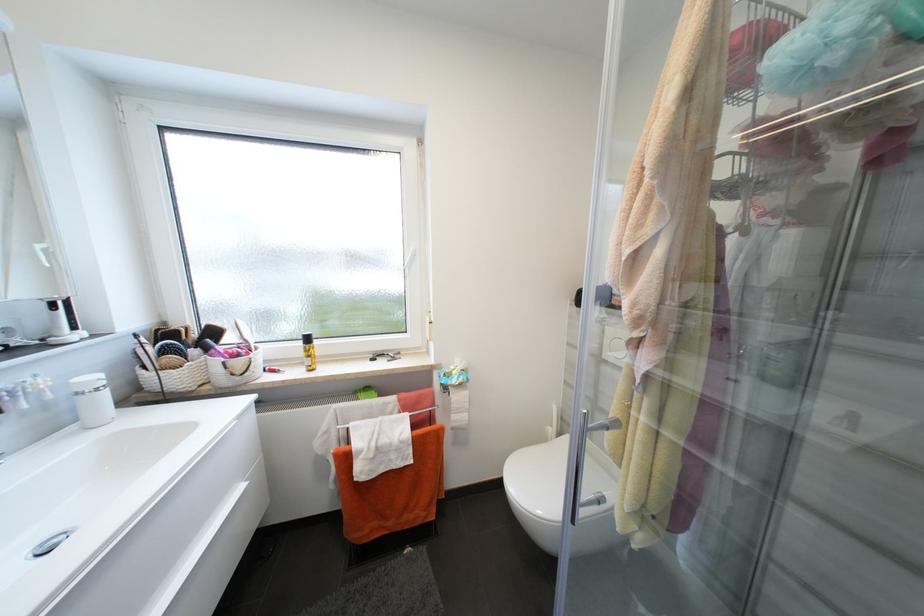
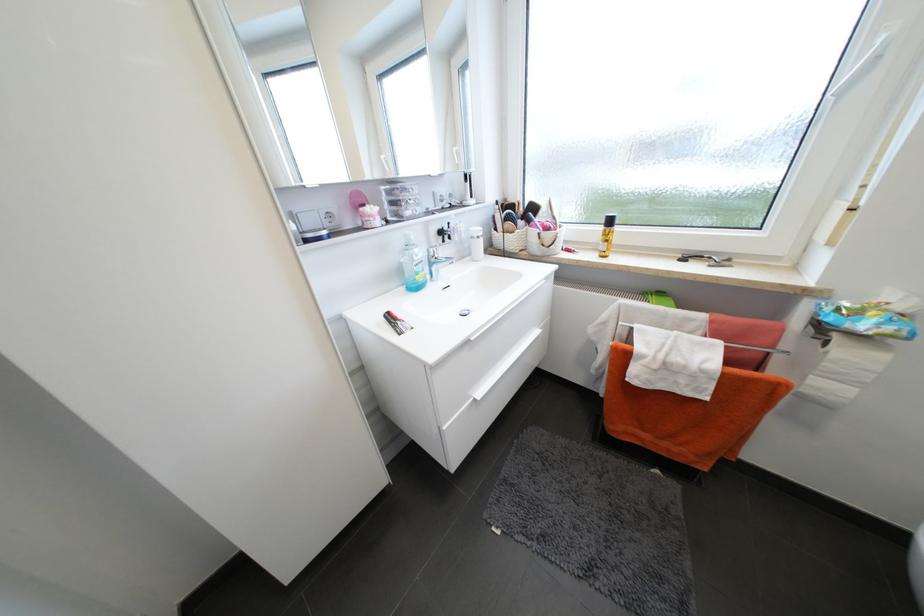
Where in the second image is the point corresponding to (x=83, y=395) from the first image?

(478, 238)